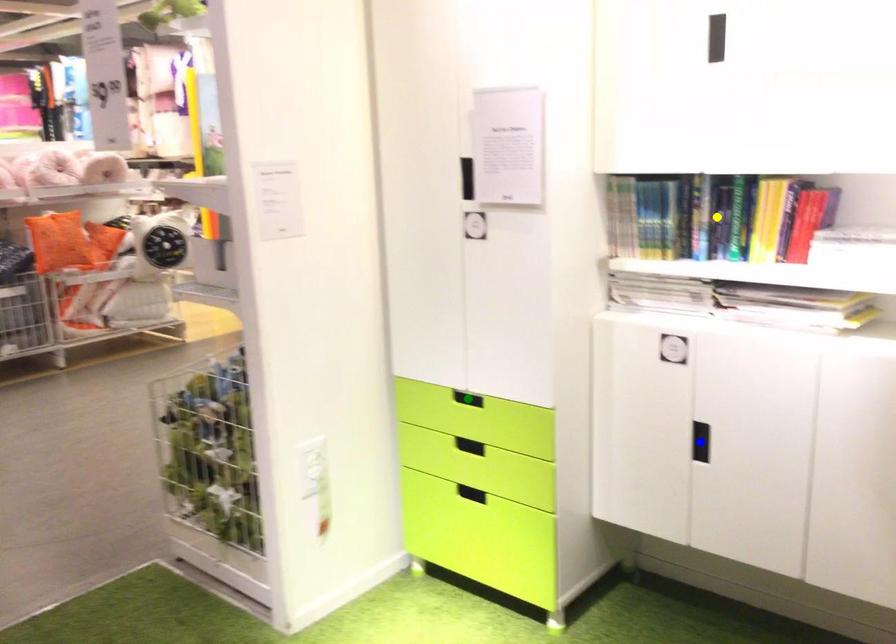
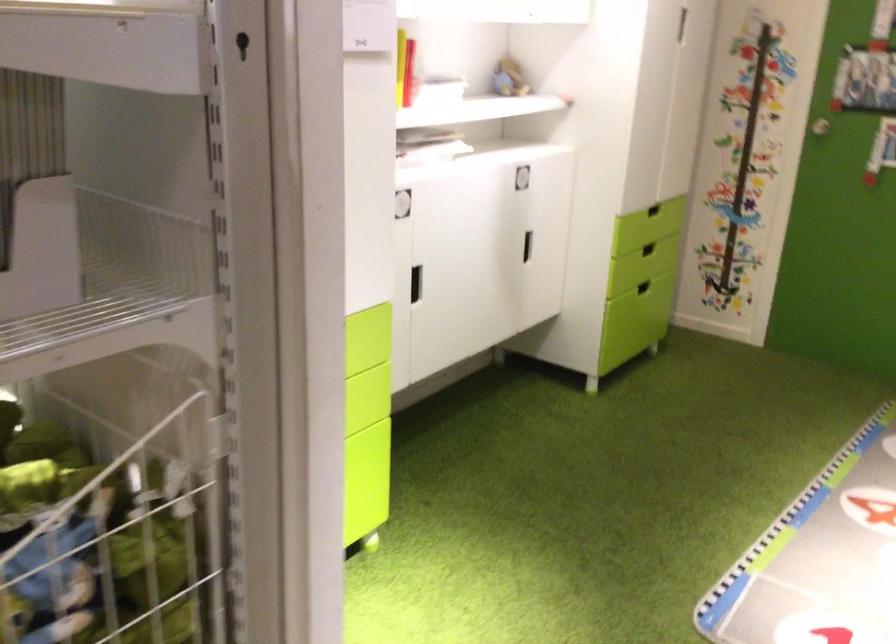
I am providing you with two images of the same scene from different viewpoints. Three points are marked in image1. Which point corresponds to a part or object that is occluded in image2?In image1, three points are marked. Which of them correspond to a part or object that is occluded in image2?Among the three points shown in image1, which one corresponds to a part or object that is no longer visible due to occlusion in image2?

blue point, green point, yellow point cannot be seen in image2.